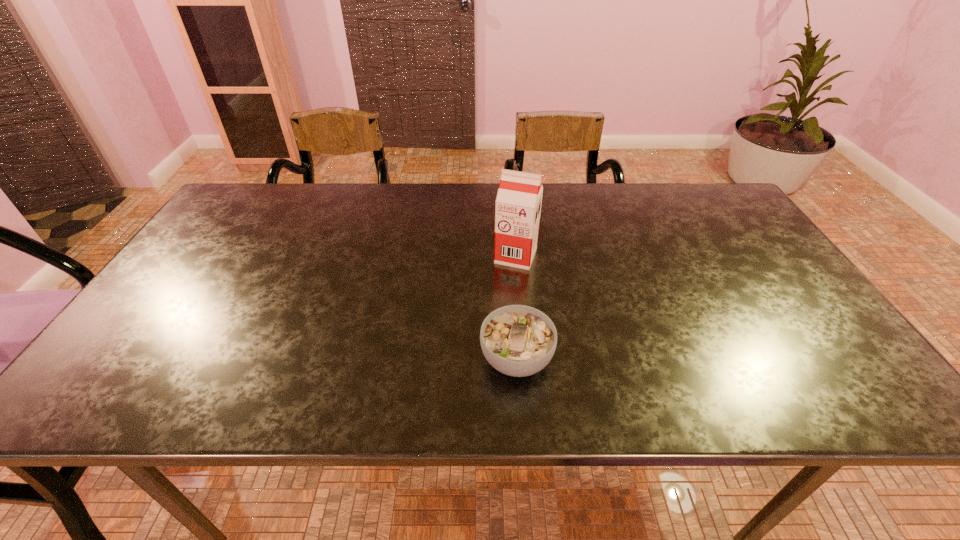
Identify the location of the taller object. The image size is (960, 540). (518, 203).

At what (x,y) coordinates should I click in order to perform the action: click on soya milk. Please return your answer as a coordinate pair (x, y). The width and height of the screenshot is (960, 540). Looking at the image, I should click on (518, 203).

Locate an element on the screen. The height and width of the screenshot is (540, 960). the nearer object is located at coordinates (517, 340).

Where is `soup bowl`? The height and width of the screenshot is (540, 960). soup bowl is located at coordinates (517, 340).

The height and width of the screenshot is (540, 960). Find the location of `vacant space located 0.250m on the back of the taller object`. vacant space located 0.250m on the back of the taller object is located at coordinates (510, 195).

You are a GUI agent. You are given a task and a screenshot of the screen. Output one action in this format:
    pyautogui.click(x=<x>, y=<y>)
    Task: Click on the vacant space situated on the right of the nearer object
    
    Given the screenshot: What is the action you would take?
    pyautogui.click(x=707, y=359)

Find the location of a particular element. object located at the near edge is located at coordinates (517, 340).

Find the location of a particular element. This screenshot has width=960, height=540. vacant space at the far edge of the desktop is located at coordinates (664, 189).

At what (x,y) coordinates should I click in order to perform the action: click on blank space at the near edge. Please return your answer as a coordinate pair (x, y). This screenshot has width=960, height=540. Looking at the image, I should click on (736, 381).

This screenshot has height=540, width=960. What are the coordinates of `free space at the right edge` in the screenshot? It's located at (714, 254).